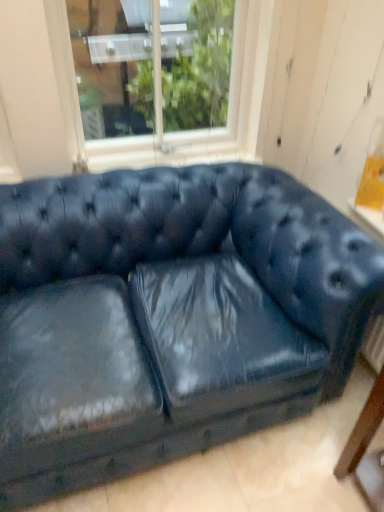
Question: Is point (132, 351) closer or farther from the camera than point (246, 122)?

Choices:
 (A) farther
 (B) closer

Answer: (B)

Question: Is matte blue leather couch at center bigger or smaller than white wood window at upper center?

Choices:
 (A) big
 (B) small

Answer: (A)

Question: From the image's perspective, is matte blue leather couch at center above or below white wood window at upper center?

Choices:
 (A) below
 (B) above

Answer: (A)

Question: Would you say white wood window at upper center is to the left or to the right of matte blue leather couch at center in the picture?

Choices:
 (A) right
 (B) left

Answer: (B)

Question: Which is correct: white wood window at upper center is inside matte blue leather couch at center, or outside of it?

Choices:
 (A) outside
 (B) inside

Answer: (A)

Question: From the image's perspective, is white wood window at upper center above or below matte blue leather couch at center?

Choices:
 (A) below
 (B) above

Answer: (B)

Question: From a real-world perspective, is white wood window at upper center positioned above or below matte blue leather couch at center?

Choices:
 (A) below
 (B) above

Answer: (B)